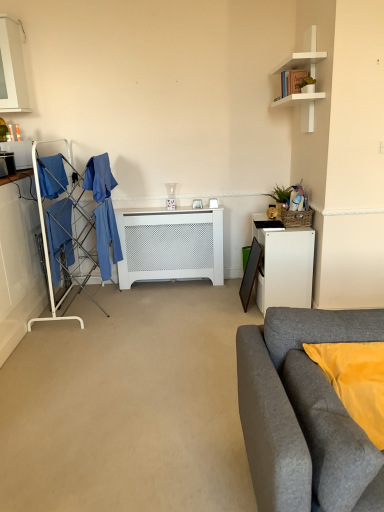
This screenshot has height=512, width=384. In order to click on free spot below blue fabric drying rack at left (from a real-world perspective) in this screenshot , I will do `click(91, 303)`.